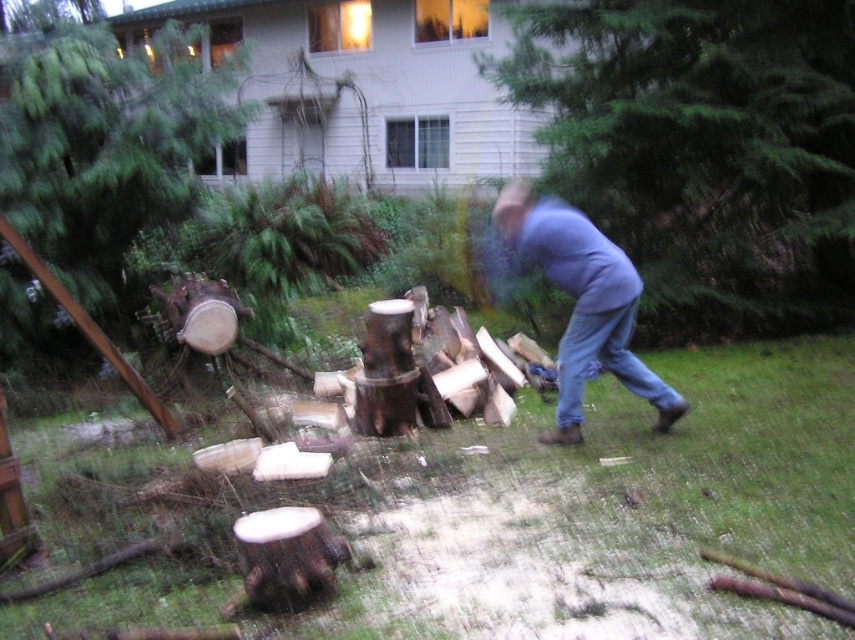
You are standing at the point with coordinates point (649, 32) and want to move towards the point with coordinates point (77, 225). Given that you can only move in straight lines, will you be moving away from or towards the camera?

Since point (649, 32) is closer to the camera than point (77, 225), moving from point (649, 32) towards point (77, 225) would mean moving away from the camera.

You are standing in the outdoor scene and want to place a small flag exactly halfway between point (142, 161) and point (635, 385). Will the flag be closer to the camera or further away than the midpoint between these two points?

The flag will be closer to the camera than the midpoint between point (142, 161) and point (635, 385) because point (142, 161) is further to the camera than point (635, 385).

You are a photographer trying to capture the person chopping wood. You notice the blue denim jeans at lower right and the smooth brown stump at left in your frame. Which object should you adjust your camera to focus on first if you want to highlight the subject of the scene?

You should focus on the smooth brown stump at left first because the blue denim jeans at lower right is behind it, meaning the stump is closer to the camera and thus the main subject.